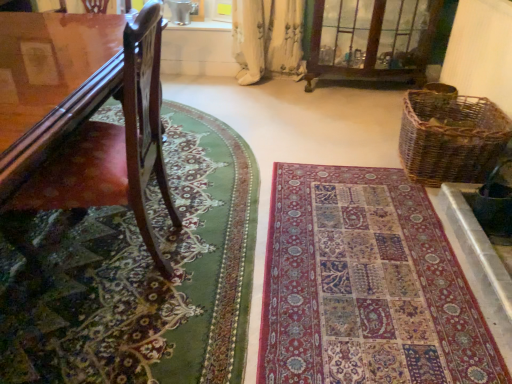
Question: Is multicolored woven rug at center, marked as the 1th mat in a right-to-left arrangement, far away from green woolen rug at lower left, marked as the 1th mat in a left-to-right arrangement?

Choices:
 (A) no
 (B) yes

Answer: (A)

Question: Can you confirm if multicolored woven rug at center, marked as the 1th mat in a right-to-left arrangement, is shorter than green woolen rug at lower left, acting as the second mat starting from the right?

Choices:
 (A) yes
 (B) no

Answer: (A)

Question: Is multicolored woven rug at center, marked as the 1th mat in a right-to-left arrangement, taller than green woolen rug at lower left, marked as the 1th mat in a left-to-right arrangement?

Choices:
 (A) yes
 (B) no

Answer: (B)

Question: Is multicolored woven rug at center, marked as the 1th mat in a right-to-left arrangement, bigger than green woolen rug at lower left, acting as the second mat starting from the right?

Choices:
 (A) yes
 (B) no

Answer: (B)

Question: Considering the relative sizes of multicolored woven rug at center, marked as the 1th mat in a right-to-left arrangement, and green woolen rug at lower left, marked as the 1th mat in a left-to-right arrangement, in the image provided, is multicolored woven rug at center, marked as the 1th mat in a right-to-left arrangement, smaller than green woolen rug at lower left, marked as the 1th mat in a left-to-right arrangement,?

Choices:
 (A) no
 (B) yes

Answer: (B)

Question: Can you confirm if multicolored woven rug at center, the 2th mat when ordered from left to right, is positioned to the right of green woolen rug at lower left, acting as the second mat starting from the right?

Choices:
 (A) yes
 (B) no

Answer: (A)

Question: Would you consider clear glass cabinet at upper center to be distant from multicolored woven rug at center, the 2th mat when ordered from left to right?

Choices:
 (A) no
 (B) yes

Answer: (B)

Question: Is clear glass cabinet at upper center thinner than multicolored woven rug at center, marked as the 1th mat in a right-to-left arrangement?

Choices:
 (A) yes
 (B) no

Answer: (A)

Question: Is the position of clear glass cabinet at upper center less distant than that of multicolored woven rug at center, the 2th mat when ordered from left to right?

Choices:
 (A) no
 (B) yes

Answer: (A)

Question: Would you say clear glass cabinet at upper center contains multicolored woven rug at center, marked as the 1th mat in a right-to-left arrangement?

Choices:
 (A) no
 (B) yes

Answer: (A)

Question: From the image's perspective, is clear glass cabinet at upper center beneath multicolored woven rug at center, marked as the 1th mat in a right-to-left arrangement?

Choices:
 (A) yes
 (B) no

Answer: (B)

Question: Can you confirm if clear glass cabinet at upper center is shorter than multicolored woven rug at center, the 2th mat when ordered from left to right?

Choices:
 (A) yes
 (B) no

Answer: (B)

Question: Is multicolored woven rug at center, marked as the 1th mat in a right-to-left arrangement, placed right next to clear glass cabinet at upper center?

Choices:
 (A) no
 (B) yes

Answer: (A)